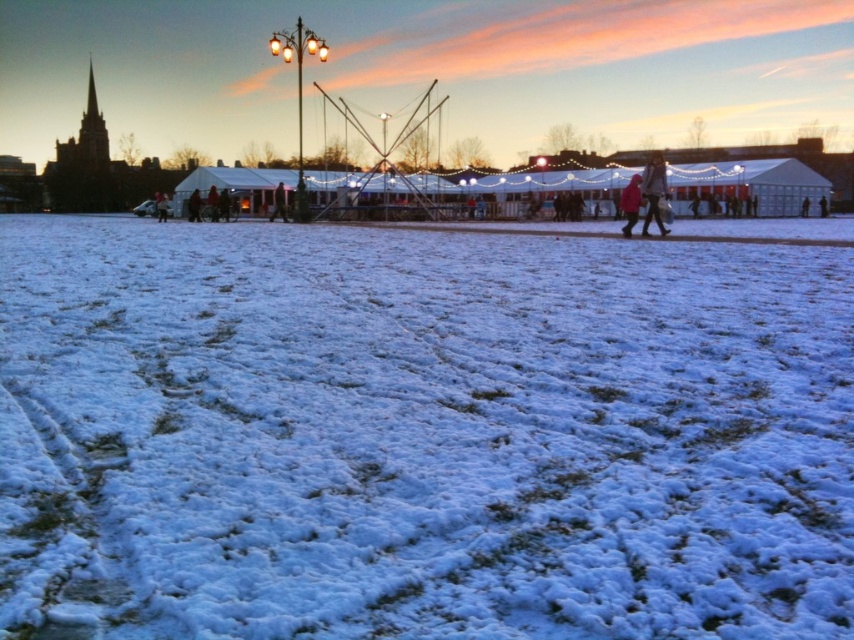
Between white fluffy snow at center and matte pink coat at center, which one appears on the left side from the viewer's perspective?

Positioned to the left is white fluffy snow at center.

Which is in front, point (366, 582) or point (632, 182)?

Positioned in front is point (366, 582).

Where is `white fluffy snow at center`? This screenshot has width=854, height=640. white fluffy snow at center is located at coordinates (419, 435).

Which is below, white fluffy snow at center or matte pink coat at right?

Positioned lower is white fluffy snow at center.

Which of these two, white fluffy snow at center or matte pink coat at right, stands shorter?

white fluffy snow at center

Where is `white fluffy snow at center`? This screenshot has width=854, height=640. white fluffy snow at center is located at coordinates (419, 435).

Who is higher up, matte pink coat at right or matte pink coat at center?

matte pink coat at right

Is matte pink coat at right taller than matte pink coat at center?

Indeed, matte pink coat at right has a greater height compared to matte pink coat at center.

Which is in front, point (656, 164) or point (626, 227)?

Positioned in front is point (656, 164).

This screenshot has height=640, width=854. Find the location of `matte pink coat at right`. matte pink coat at right is located at coordinates (654, 193).